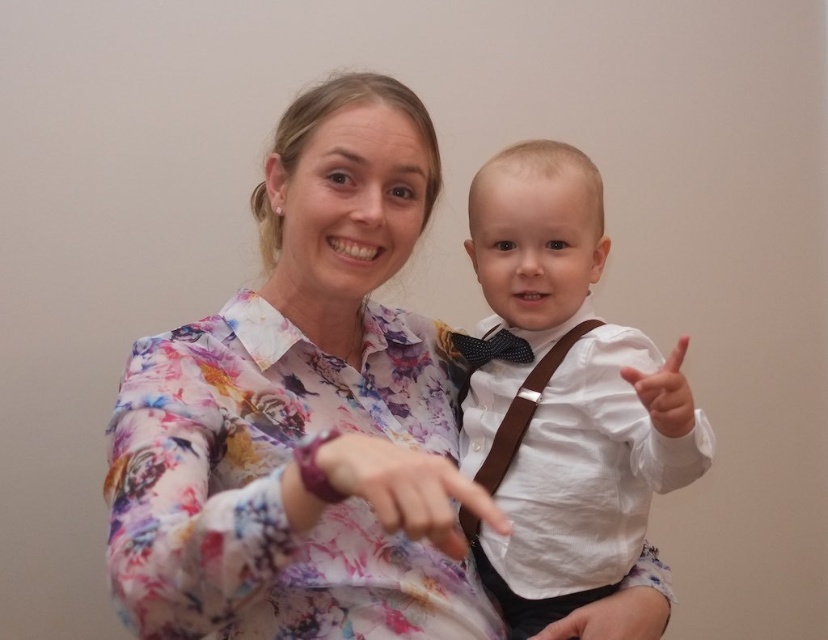
Who is more distant from viewer, (562, 340) or (670, 392)?

The point (562, 340) is behind.

Can you confirm if brown leather suspenders at center is thinner than white matte hand at right?

No.

Who is more distant from viewer, (492, 440) or (677, 371)?

Positioned behind is point (492, 440).

The width and height of the screenshot is (828, 640). In order to click on brown leather suspenders at center in this screenshot , I will do `click(523, 410)`.

Can you confirm if white linen shirt at center is smaller than brown leather suspenders at center?

No, white linen shirt at center is not smaller than brown leather suspenders at center.

Is white linen shirt at center thinner than brown leather suspenders at center?

No.

Which is in front, point (658, 454) or point (475, 525)?

Positioned in front is point (658, 454).

Identify the location of white linen shirt at center. (564, 397).

I want to click on floral print blouse at center, so click(x=301, y=412).

Is floral print blouse at center positioned behind white matte hand at right?

No, floral print blouse at center is closer to the viewer.

You are a GUI agent. You are given a task and a screenshot of the screen. Output one action in this format:
    pyautogui.click(x=<x>, y=<y>)
    Task: Click on the floral print blouse at center
    
    Given the screenshot: What is the action you would take?
    pyautogui.click(x=301, y=412)